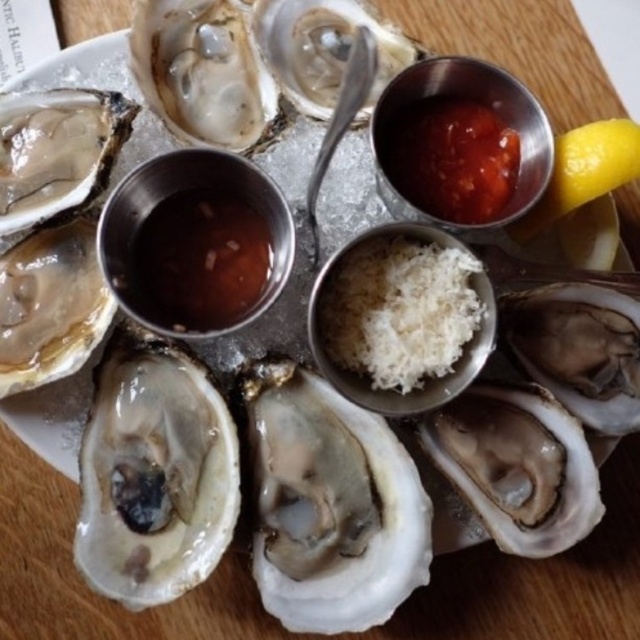
Is white shredded cheese at center to the right of yellow matte lemon at upper right from the viewer's perspective?

No, white shredded cheese at center is not to the right of yellow matte lemon at upper right.

In the scene shown: Does white shredded cheese at center have a lesser height compared to yellow matte lemon at upper right?

No.

Does point (406, 244) lie in front of point (602, 140)?

Yes, point (406, 244) is closer to viewer.

What are the coordinates of `white shredded cheese at center` in the screenshot? It's located at (397, 310).

Can you confirm if semi-translucent brown sauce at center is thinner than tomato paste at upper center?

Correct, semi-translucent brown sauce at center's width is less than tomato paste at upper center's.

Measure the distance between semi-translucent brown sauce at center and tomato paste at upper center.

semi-translucent brown sauce at center is 10.93 inches away from tomato paste at upper center.

Is point (248, 291) farther from viewer compared to point (426, 120)?

No, (248, 291) is in front of (426, 120).

Where is `semi-translucent brown sauce at center`? semi-translucent brown sauce at center is located at coordinates (198, 260).

Consider the image. Between tomato paste at upper center and yellow matte lemon at upper right, which one is positioned higher?

tomato paste at upper center is above.

Does tomato paste at upper center lie behind yellow matte lemon at upper right?

Yes, tomato paste at upper center is behind yellow matte lemon at upper right.

Is point (470, 131) closer to viewer compared to point (600, 141)?

No, it is behind (600, 141).

What are the coordinates of `tomato paste at upper center` in the screenshot? It's located at (451, 157).